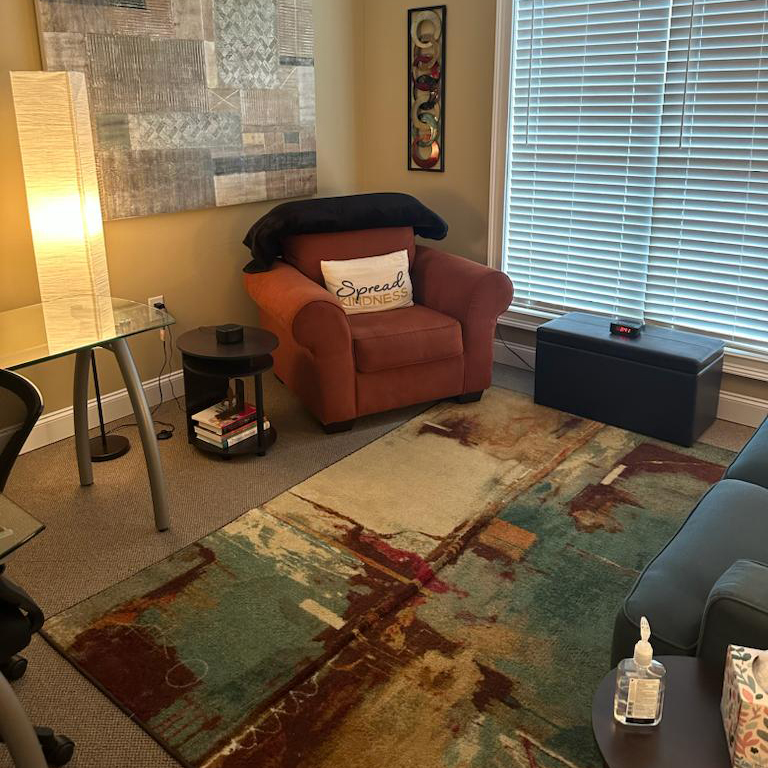
Locate an element on the screen. This screenshot has width=768, height=768. side table is located at coordinates (677, 746).